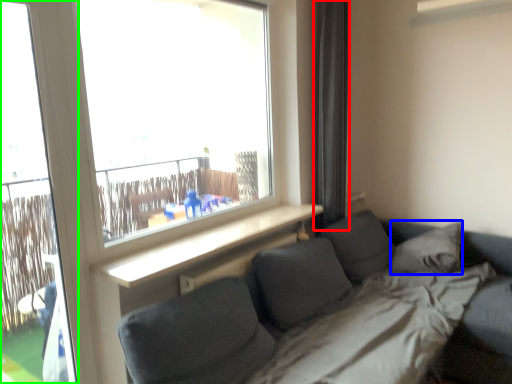
Question: Which object is the closest to the curtain (highlighted by a red box)? Choose among these: pillow (highlighted by a blue box) or screen door (highlighted by a green box).

Choices:
 (A) pillow
 (B) screen door

Answer: (A)